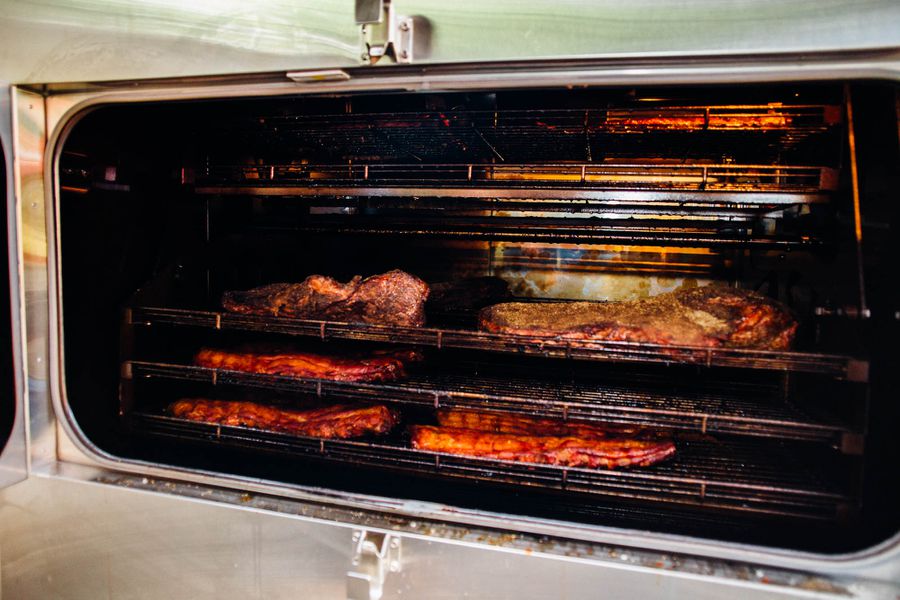
This screenshot has width=900, height=600. What are the coordinates of `top rack` in the screenshot? It's located at (452, 343).